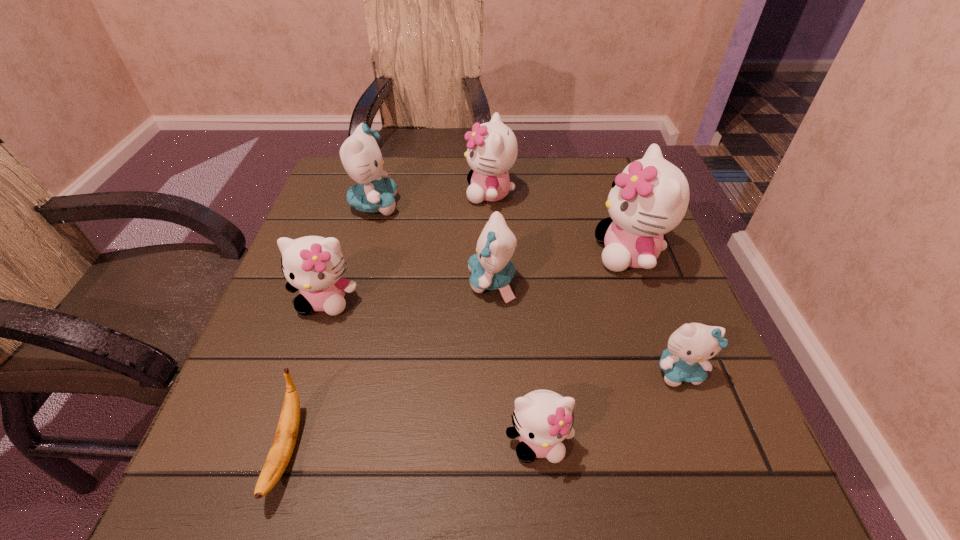
Find the location of a particular element. This screenshot has width=960, height=540. vacant area that lies between the tallest object and the second biggest white kitten is located at coordinates (560, 224).

Identify the location of free spot between the farthest white kitten and the leftmost white kitten. This screenshot has width=960, height=540. (408, 247).

Find the location of a particular element. The height and width of the screenshot is (540, 960). empty space between the yellow banana and the nearest white kitten is located at coordinates (413, 446).

Locate an element on the screen. free space between the nearest kitten and the second biggest white kitten is located at coordinates (515, 318).

Where is `free space between the third biggest white kitten and the farthest blue kitten`? Image resolution: width=960 pixels, height=540 pixels. free space between the third biggest white kitten and the farthest blue kitten is located at coordinates (350, 253).

Where is `empty location between the tallest kitten and the shortest object`? This screenshot has width=960, height=540. empty location between the tallest kitten and the shortest object is located at coordinates (458, 352).

Identify the location of unoccupied area between the smallest white kitten and the second blue kitten from right to left. The height and width of the screenshot is (540, 960). (516, 362).

Locate which object is the sixth closest to the farthest white kitten. Please provide its 2D coordinates. Your answer should be formatted as a tuple, i.e. [(x, y)], where the tuple contains the x and y coordinates of a point satisfying the conditions above.

[(542, 419)]

Identify which object is the seventh closest to the nearest blue kitten. Please provide its 2D coordinates. Your answer should be formatted as a tuple, i.e. [(x, y)], where the tuple contains the x and y coordinates of a point satisfying the conditions above.

[(360, 154)]

In order to click on kitten that is the sixth closest to the leftmost white kitten in this screenshot , I will do `click(690, 346)`.